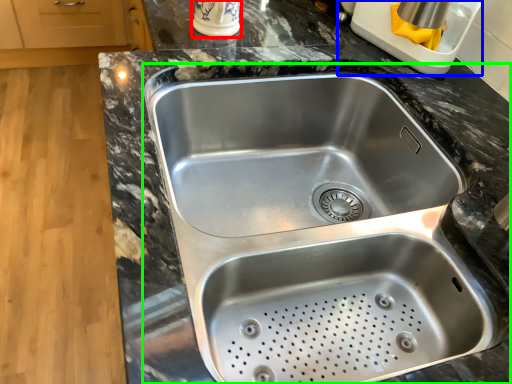
Question: Based on their relative distances, which object is nearer to appliance (highlighted by a red box)? Choose from appliance (highlighted by a blue box) and sink (highlighted by a green box).

Choices:
 (A) appliance
 (B) sink

Answer: (A)